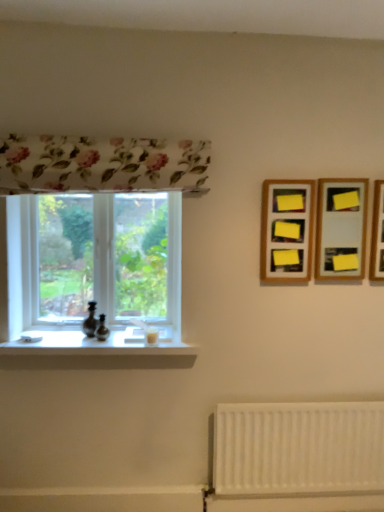
Question: From a real-world perspective, is yellow paper at upper right, the second picture frame viewed from the left, positioned under white matte radiator at lower right based on gravity?

Choices:
 (A) no
 (B) yes

Answer: (A)

Question: Is yellow paper at upper right, the second picture frame viewed from the left, far from white matte radiator at lower right?

Choices:
 (A) yes
 (B) no

Answer: (B)

Question: Considering the relative positions of yellow paper at upper right, the second picture frame viewed from the left, and white matte radiator at lower right in the image provided, is yellow paper at upper right, the second picture frame viewed from the left, to the left of white matte radiator at lower right from the viewer's perspective?

Choices:
 (A) no
 (B) yes

Answer: (A)

Question: From the image's perspective, is yellow paper at upper right, which is the 2th picture frame from right to left, located beneath white matte radiator at lower right?

Choices:
 (A) no
 (B) yes

Answer: (A)

Question: Is yellow paper at upper right, which is the 2th picture frame from right to left, located outside white matte radiator at lower right?

Choices:
 (A) no
 (B) yes

Answer: (B)

Question: In terms of height, does white matte radiator at lower right look taller or shorter compared to yellow paper at upper right, the second picture frame viewed from the left?

Choices:
 (A) short
 (B) tall

Answer: (B)

Question: From a real-world perspective, is white matte radiator at lower right positioned above or below yellow paper at upper right, the second picture frame viewed from the left?

Choices:
 (A) below
 (B) above

Answer: (A)

Question: In the image, is white matte radiator at lower right positioned in front of or behind yellow paper at upper right, which is the 2th picture frame from right to left?

Choices:
 (A) front
 (B) behind

Answer: (B)

Question: Based on their sizes in the image, would you say white matte radiator at lower right is bigger or smaller than yellow paper at upper right, which is the 2th picture frame from right to left?

Choices:
 (A) big
 (B) small

Answer: (A)

Question: Relative to clear glass window at left, is white glossy window sill at lower left in front or behind?

Choices:
 (A) front
 (B) behind

Answer: (A)

Question: Is white glossy window sill at lower left situated inside clear glass window at left or outside?

Choices:
 (A) outside
 (B) inside

Answer: (A)

Question: Is white glossy window sill at lower left to the left or to the right of clear glass window at left in the image?

Choices:
 (A) right
 (B) left

Answer: (B)

Question: From a real-world perspective, is white glossy window sill at lower left above or below clear glass window at left?

Choices:
 (A) above
 (B) below

Answer: (B)

Question: Considering the relative positions of clear glass window at left and yellow paper at upper right, which is the 2th picture frame from right to left, in the image provided, is clear glass window at left to the left or to the right of yellow paper at upper right, which is the 2th picture frame from right to left,?

Choices:
 (A) left
 (B) right

Answer: (A)

Question: Does point (162, 261) appear closer or farther from the camera than point (334, 234)?

Choices:
 (A) closer
 (B) farther

Answer: (B)